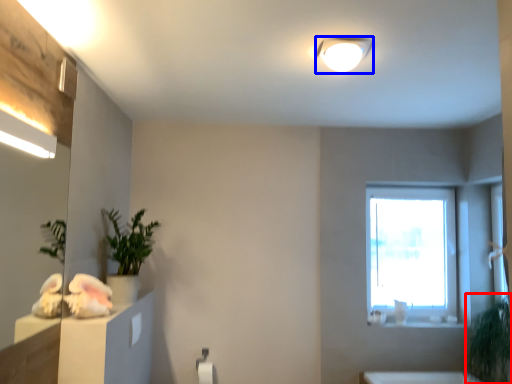
Question: Among these objects, which one is farthest to the camera, plant (highlighted by a red box) or light fixture (highlighted by a blue box)?

Choices:
 (A) plant
 (B) light fixture

Answer: (A)